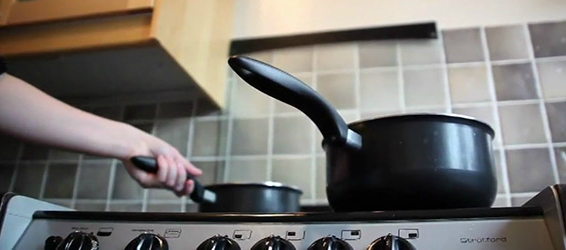
Locate an element on the screen. This screenshot has width=566, height=250. knobs controlling the burner plates is located at coordinates tap(215, 239), tap(273, 241), tap(317, 245), tap(389, 242).